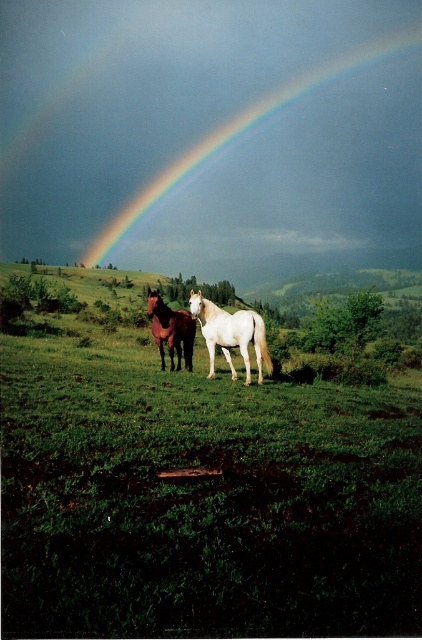
Question: Does green grassy field at center come in front of rainbow at upper center?

Choices:
 (A) yes
 (B) no

Answer: (A)

Question: Which object appears farthest from the camera in this image?

Choices:
 (A) rainbow at upper center
 (B) white glossy horse at center
 (C) green grassy field at center

Answer: (A)

Question: Which point appears closest to the camera in this image?

Choices:
 (A) (51, 417)
 (B) (124, 212)
 (C) (213, 364)
 (D) (154, 314)

Answer: (A)

Question: Does green grassy field at center appear on the right side of white glossy horse at center?

Choices:
 (A) no
 (B) yes

Answer: (A)

Question: Is green grassy field at center thinner than brown glossy horse at center?

Choices:
 (A) no
 (B) yes

Answer: (A)

Question: Which of the following is the closest to the observer?

Choices:
 (A) [194, 292]
 (B) [227, 140]
 (C) [161, 317]

Answer: (A)